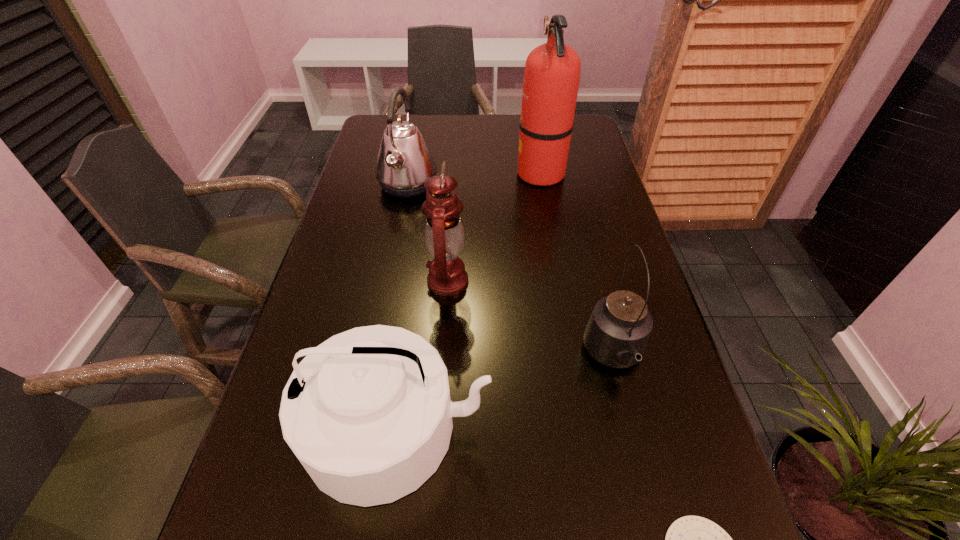
The width and height of the screenshot is (960, 540). In order to click on the tallest object in this screenshot , I will do `click(552, 71)`.

Locate an element on the screen. the fourth nearest object is located at coordinates (444, 235).

I want to click on the farthest kettle, so click(404, 162).

The width and height of the screenshot is (960, 540). What are the coordinates of `the rightmost kettle` in the screenshot? It's located at tap(617, 333).

Image resolution: width=960 pixels, height=540 pixels. What are the coordinates of `vacant space situated 0.390m on the side of the fire extinguisher with the nozzle and handle` in the screenshot? It's located at (391, 173).

The image size is (960, 540). I want to click on vacant area situated on the side of the fire extinguisher with the nozzle and handle, so click(x=426, y=173).

At what (x,y) coordinates should I click in order to perform the action: click on vacant space located on the side of the fire extinguisher with the nozzle and handle. Please return your answer as a coordinate pair (x, y). Looking at the image, I should click on (445, 173).

The height and width of the screenshot is (540, 960). In order to click on blank area located 0.320m on the right of the third farthest object in this screenshot , I will do `click(603, 281)`.

You are a GUI agent. You are given a task and a screenshot of the screen. Output one action in this format:
    pyautogui.click(x=<x>, y=<y>)
    Task: Click on the vacant area situated 0.080m on the front of the farthest kettle
    The height and width of the screenshot is (540, 960).
    Given the screenshot: What is the action you would take?
    pyautogui.click(x=400, y=226)

The width and height of the screenshot is (960, 540). I want to click on vacant region located 0.060m spout on the rightmost kettle, so click(x=632, y=426).